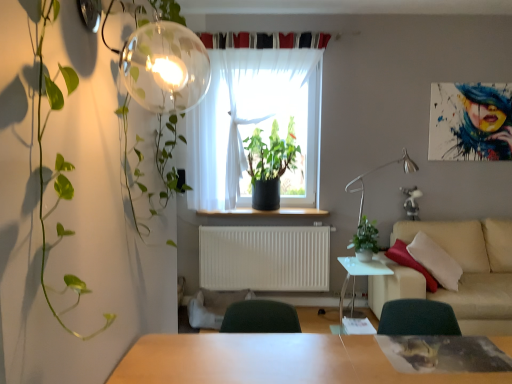
Question: Is green matte plant at center, the 2th houseplant from the right, positioned with its back to white sheer curtain at center?

Choices:
 (A) no
 (B) yes

Answer: (A)

Question: From a real-world perspective, is green matte plant at center, the 2th houseplant from the right, physically above white sheer curtain at center?

Choices:
 (A) no
 (B) yes

Answer: (A)

Question: Considering the relative sizes of green matte plant at center, which ranks as the 1th houseplant in left-to-right order, and white sheer curtain at center in the image provided, is green matte plant at center, which ranks as the 1th houseplant in left-to-right order, wider than white sheer curtain at center?

Choices:
 (A) yes
 (B) no

Answer: (A)

Question: Does green matte plant at center, which ranks as the 1th houseplant in back-to-front order, appear on the left side of white sheer curtain at center?

Choices:
 (A) yes
 (B) no

Answer: (B)

Question: From a real-world perspective, is green matte plant at center, which is the second houseplant from front to back, beneath white sheer curtain at center?

Choices:
 (A) yes
 (B) no

Answer: (A)

Question: Considering their positions, is green matte plant at center, which appears as the 2th houseplant when ordered from the bottom, located in front of or behind transparent glass globe at upper left?

Choices:
 (A) behind
 (B) front

Answer: (A)

Question: Visually, is green matte plant at center, which is the second houseplant from front to back, positioned to the left or to the right of transparent glass globe at upper left?

Choices:
 (A) left
 (B) right

Answer: (B)

Question: Considering the positions of green matte plant at center, which ranks as the 1th houseplant in back-to-front order, and transparent glass globe at upper left in the image, is green matte plant at center, which ranks as the 1th houseplant in back-to-front order, taller or shorter than transparent glass globe at upper left?

Choices:
 (A) tall
 (B) short

Answer: (A)

Question: Considering the positions of green matte plant at center, which appears as the 2th houseplant when ordered from the bottom, and transparent glass globe at upper left in the image, is green matte plant at center, which appears as the 2th houseplant when ordered from the bottom, wider or thinner than transparent glass globe at upper left?

Choices:
 (A) thin
 (B) wide

Answer: (B)

Question: Looking at their shapes, would you say white matte radiator at center is wider or thinner than beige fabric couch at right?

Choices:
 (A) wide
 (B) thin

Answer: (B)

Question: In terms of size, does white matte radiator at center appear bigger or smaller than beige fabric couch at right?

Choices:
 (A) big
 (B) small

Answer: (B)

Question: From the image's perspective, is white matte radiator at center above or below beige fabric couch at right?

Choices:
 (A) above
 (B) below

Answer: (A)

Question: From a real-world perspective, relative to beige fabric couch at right, is white matte radiator at center vertically above or below?

Choices:
 (A) above
 (B) below

Answer: (A)

Question: Visually, is white sheer curtain at center positioned to the left or to the right of silver metallic table lamp at right?

Choices:
 (A) right
 (B) left

Answer: (B)

Question: Considering the positions of white sheer curtain at center and silver metallic table lamp at right in the image, is white sheer curtain at center wider or thinner than silver metallic table lamp at right?

Choices:
 (A) wide
 (B) thin

Answer: (B)